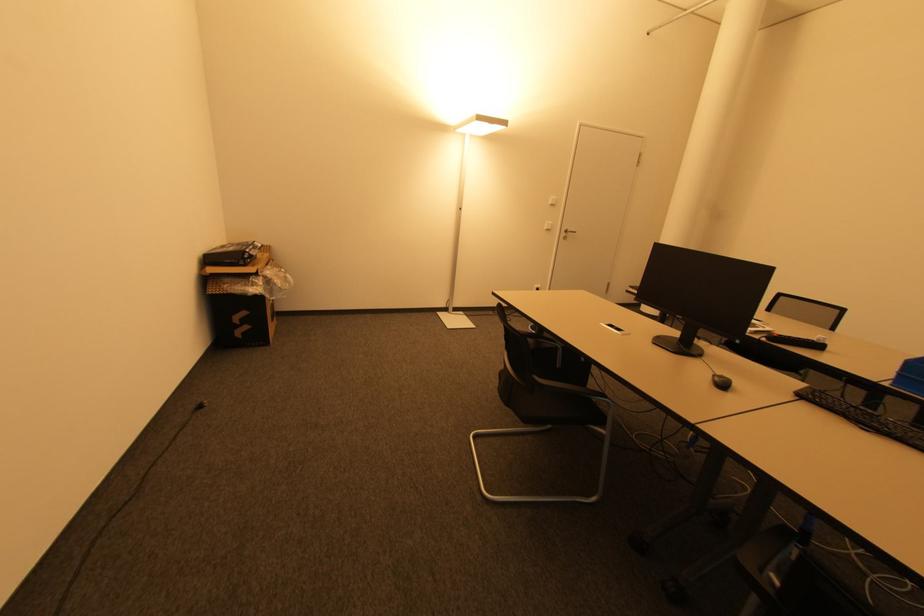
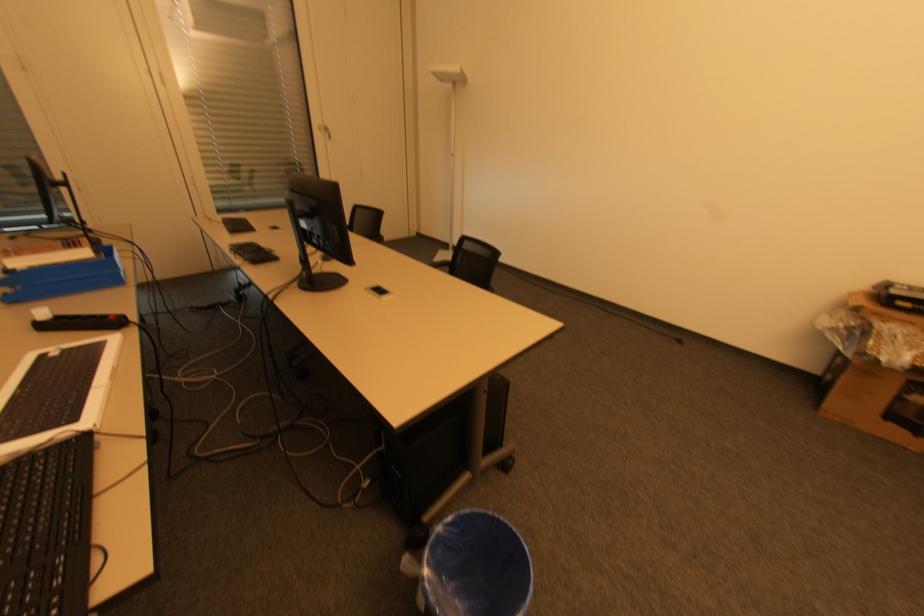
The point at (x=265, y=285) is marked in the first image. Where is the corresponding point in the second image?

(850, 328)